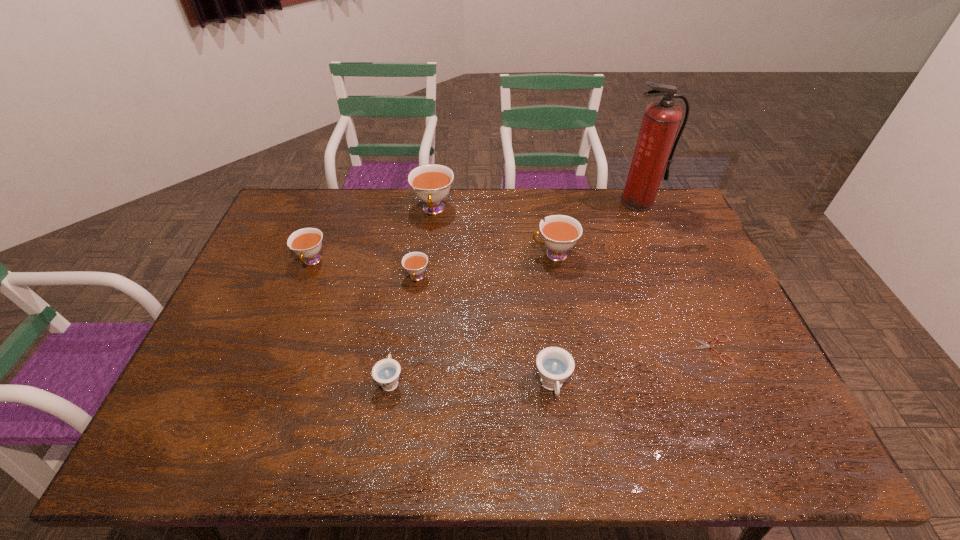
The height and width of the screenshot is (540, 960). I want to click on object that is positioned at the far right corner, so click(661, 120).

You are a GUI agent. You are given a task and a screenshot of the screen. Output one action in this format:
    pyautogui.click(x=<x>, y=<y>)
    Task: Click on the vacant space at the far edge
    
    Given the screenshot: What is the action you would take?
    pyautogui.click(x=348, y=217)

The width and height of the screenshot is (960, 540). I want to click on free space at the near edge, so click(x=575, y=460).

I want to click on vacant area at the left edge of the desktop, so click(276, 264).

In the image, there is a desktop. Where is `free space at the right edge`? The height and width of the screenshot is (540, 960). free space at the right edge is located at coordinates (652, 242).

The width and height of the screenshot is (960, 540). I want to click on vacant space at the far right corner of the desktop, so click(678, 227).

I want to click on free spot between the third nearest object and the leftmost teacup, so click(x=513, y=305).

At what (x,y) coordinates should I click in order to perform the action: click on free spot between the second tallest teacup and the left blue teacup. Please return your answer as a coordinate pair (x, y). This screenshot has height=540, width=960. Looking at the image, I should click on (472, 318).

Locate an element on the screen. This screenshot has width=960, height=540. free spot between the third nearest object and the leftmost white teacup is located at coordinates pos(513,305).

Image resolution: width=960 pixels, height=540 pixels. In order to click on vacant area that lies between the red fire extinguisher and the left blue teacup in this screenshot , I will do `click(514, 291)`.